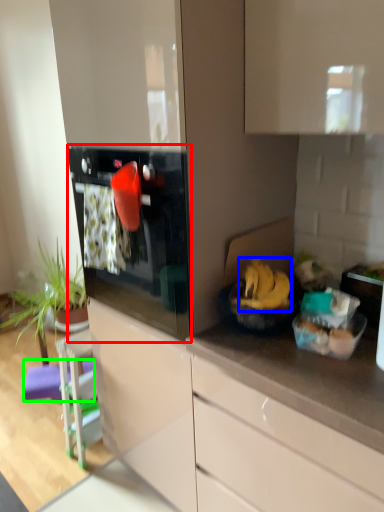
Question: Which is farther away from oven (highlighted by a red box)? banana (highlighted by a blue box) or bar stool (highlighted by a green box)?

Choices:
 (A) banana
 (B) bar stool

Answer: (B)